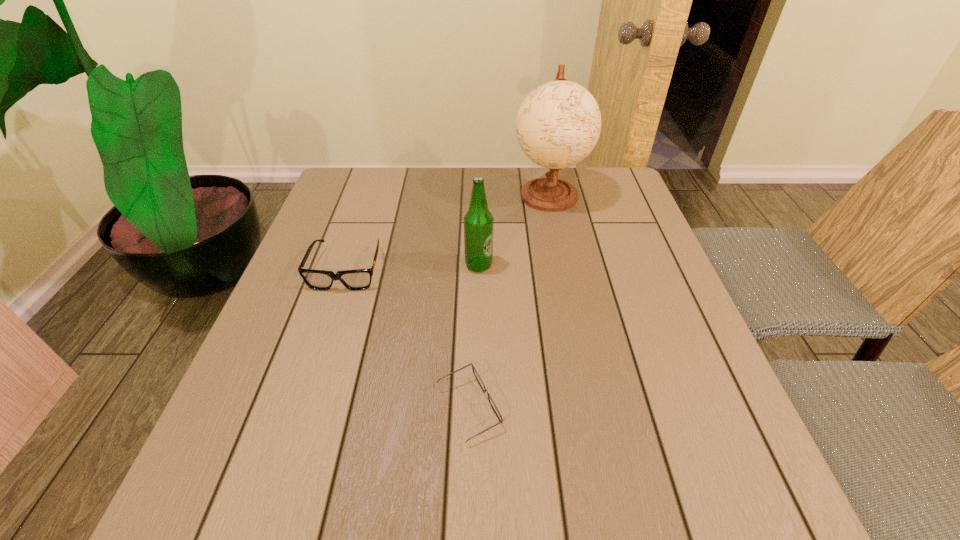
Locate an element on the screen. The height and width of the screenshot is (540, 960). object identified as the third closest to the leftmost object is located at coordinates (558, 124).

Locate an element on the screen. The height and width of the screenshot is (540, 960). object that is the third closest to the leftmost object is located at coordinates (558, 124).

Where is `vacant space that satisfies the following two spatial constraints: 1. on the surface of the rightmost object; 2. on the label of the third shortest object`? vacant space that satisfies the following two spatial constraints: 1. on the surface of the rightmost object; 2. on the label of the third shortest object is located at coordinates (564, 265).

Locate an element on the screen. free space that satisfies the following two spatial constraints: 1. on the surface of the farthest object; 2. on the label of the beer bottle is located at coordinates (564, 265).

Identify the location of vacant region that satisfies the following two spatial constraints: 1. on the label of the beer bottle; 2. on the front-facing side of the leftmost object. (479, 269).

Where is `free location that satisfies the following two spatial constraints: 1. on the label of the third shortest object; 2. on the front-facing side of the leftmost object`? This screenshot has width=960, height=540. free location that satisfies the following two spatial constraints: 1. on the label of the third shortest object; 2. on the front-facing side of the leftmost object is located at coordinates (479, 269).

Find the location of `free space that satisfies the following two spatial constraints: 1. on the label of the beer bottle; 2. on the front-facing side of the sunglasses`. free space that satisfies the following two spatial constraints: 1. on the label of the beer bottle; 2. on the front-facing side of the sunglasses is located at coordinates (479, 269).

Identify the location of free space in the image that satisfies the following two spatial constraints: 1. on the surface of the farthest object; 2. with the lenses facing outward on the spectacles. (593, 409).